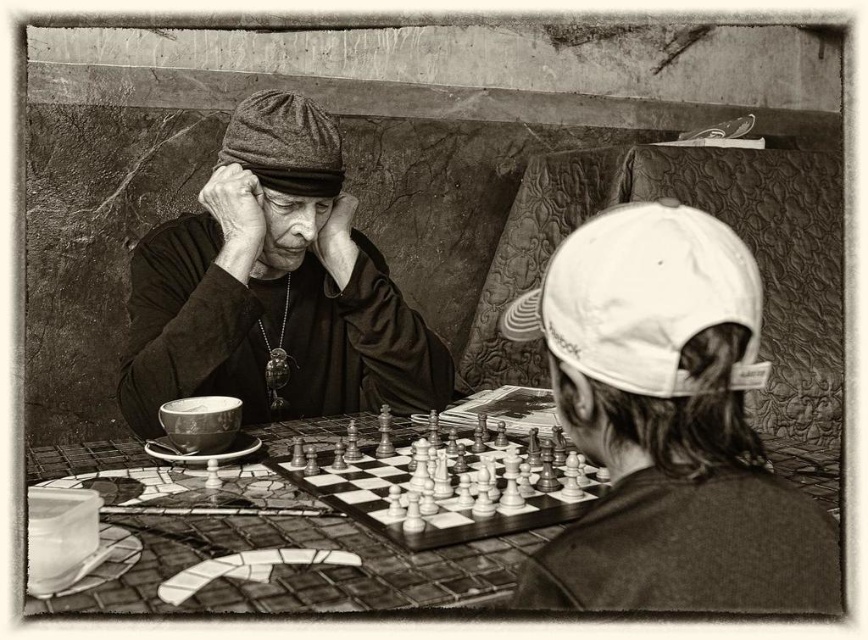
You are a photographer analyzing this black and white photo. You notice two hats in the scene. Which hat is positioned higher in the frame between the dark woolen cap at upper left and the white fabric baseball cap at upper right?

The dark woolen cap at upper left is positioned higher in the frame than the white fabric baseball cap at upper right.

You are a photographer who wants to capture a closeup of the chessboard without cropping the table it is on. Given that your camera has a fixed focus range, will the entire wooden chessboard at center be visible if you focus on the mosaic tile table at center?

The mosaic tile table at center is taller than wooden chessboard at center. Therefore, focusing on the mosaic tile table at center will ensure the wooden chessboard at center is within the focus range and fully visible.

You are a photographer who wants to capture a closeup of both the wooden chessboard at center and the gray woolen baseball cap at upper center in the scene. Given that your camera has a fixed focus range of 20 inches, will you be able to include both objects in the same frame without moving the camera?

The wooden chessboard at center and the gray woolen baseball cap at upper center are 20.88 inches apart from each other. Since the distance between them exceeds the camera focus range of 20 inches, you cannot capture both objects in the same frame without moving the camera.